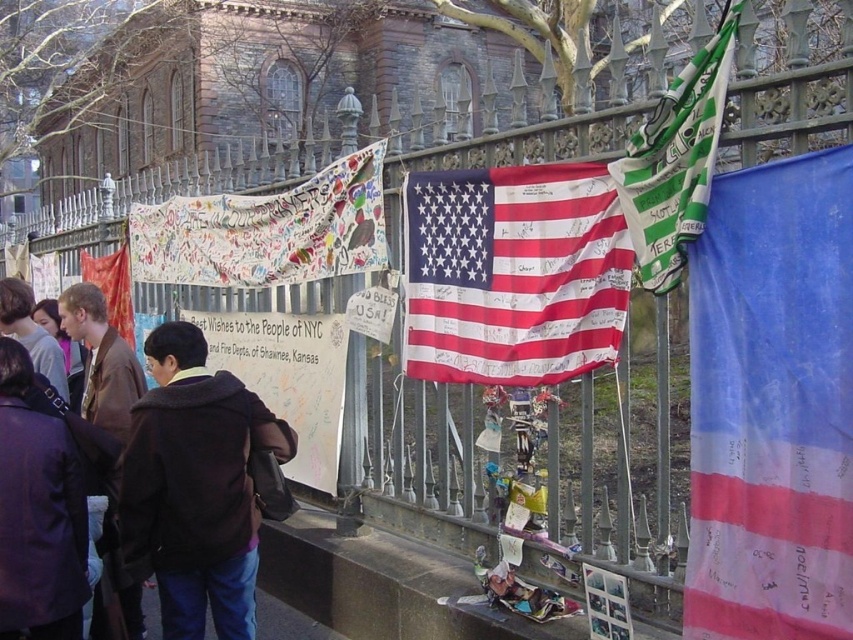
You are a photographer trying to capture both the blue fabric flag at right and the matte purple jacket at lower left in a single shot. Which object should you focus on first to ensure both are in frame?

You should focus on the blue fabric flag at right first since it is larger and positioned centrally, ensuring both objects remain within the camera frame.

You are a photographer standing in the plaza and want to capture both the blue fabric flag at right and the matte purple jacket at lower left in a single photo. Which object should you adjust your camera angle to focus on first to ensure both are in frame?

The blue fabric flag at right is above the matte purple jacket at lower left, so you should first focus on the blue fabric flag at right to ensure the camera angle captures both objects in the frame.

You are standing at the point marked by the coordinates point (734, 244). You want to take a photo of the large American flag in the center right of the image. Is the flag within your camera view if your camera has a 10 feet range?

The distance of point (734, 244) from camera is 13.79 feet. Since the camera has a 10 feet range, the flag is beyond the camera range and cannot be captured.